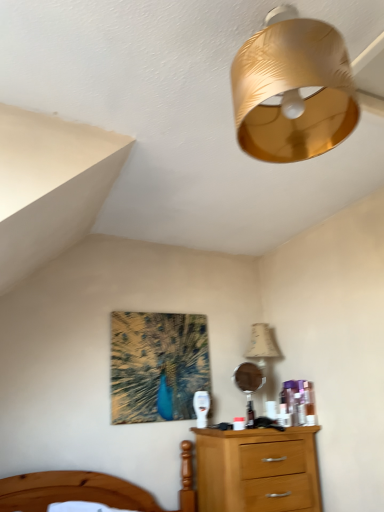
Identify the location of wooden bed at lower left. (72, 490).

What do you see at coordinates (72, 490) in the screenshot? Image resolution: width=384 pixels, height=512 pixels. I see `wooden bed at lower left` at bounding box center [72, 490].

You are a GUI agent. You are given a task and a screenshot of the screen. Output one action in this format:
    pyautogui.click(x=<x>, y=<y>)
    Task: Click on the beige fabric lampshade at upper right
    This screenshot has height=512, width=384.
    Given the screenshot: What is the action you would take?
    (x=263, y=353)

Locate an element on the screen. The height and width of the screenshot is (512, 384). wooden bed at lower left is located at coordinates pos(72,490).

From the picture: From the image's perspective, is beige fabric lampshade at upper right under metallic round mirror at center?

No.

You are a GUI agent. You are given a task and a screenshot of the screen. Output one action in this format:
    pyautogui.click(x=<x>, y=<y>)
    Task: Click on the mirror in front of the beige fabric lampshade at upper right
    The width and height of the screenshot is (384, 512).
    Given the screenshot: What is the action you would take?
    pyautogui.click(x=249, y=386)

Is beige fabric lampshade at upper right oriented away from metallic round mirror at center?

No, beige fabric lampshade at upper right is not facing the opposite direction of metallic round mirror at center.

How many degrees apart are the facing directions of beige fabric lampshade at upper right and gold textured lampshade at upper center?

The angular difference between beige fabric lampshade at upper right and gold textured lampshade at upper center is 5.53 degrees.

Is beige fabric lampshade at upper right positioned with its back to gold textured lampshade at upper center?

No, beige fabric lampshade at upper right is not facing the opposite direction of gold textured lampshade at upper center.

How far apart are beige fabric lampshade at upper right and gold textured lampshade at upper center?

Answer: beige fabric lampshade at upper right and gold textured lampshade at upper center are 1.80 meters apart.

From a real-world perspective, which is physically above, beige fabric lampshade at upper right or gold textured lampshade at upper center?

In real-world perspective, gold textured lampshade at upper center is above.

Is gold textured lampshade at upper center facing away from wooden bed at lower left?

No, gold textured lampshade at upper center is not facing the opposite direction of wooden bed at lower left.

Is gold textured lampshade at upper center inside the boundaries of wooden bed at lower left, or outside?

gold textured lampshade at upper center is not enclosed by wooden bed at lower left.

Between gold textured lampshade at upper center and wooden bed at lower left, which one appears on the left side from the viewer's perspective?

wooden bed at lower left.

From a real-world perspective, is metallic round mirror at center positioned under beige fabric lampshade at upper right based on gravity?

Indeed, from a real-world perspective, metallic round mirror at center is positioned beneath beige fabric lampshade at upper right.

How different are the orientations of metallic round mirror at center and beige fabric lampshade at upper right in degrees?

They differ by 4.13 degrees in their facing directions.

Is metallic round mirror at center to the right of beige fabric lampshade at upper right from the viewer's perspective?

No.

Is gold textured lampshade at upper center at the back of wooden bed at lower left?

No, wooden bed at lower left is not facing away from gold textured lampshade at upper center.

Can gold textured lampshade at upper center be found inside wooden bed at lower left?

No, gold textured lampshade at upper center is not a part of wooden bed at lower left.

Can you tell me how much wooden bed at lower left and gold textured lampshade at upper center differ in facing direction?

The angular difference between wooden bed at lower left and gold textured lampshade at upper center is 16.4 degrees.

Is metallic round mirror at center to the right of wooden bed at lower left from the viewer's perspective?

Yes.

From a real-world perspective, which is physically above, metallic round mirror at center or wooden bed at lower left?

metallic round mirror at center, from a real-world perspective.

Considering the points (245, 362) and (18, 478), which point is in front, point (245, 362) or point (18, 478)?

The point (18, 478) is in front.

Is metallic round mirror at center in front of or behind wooden bed at lower left in the image?

metallic round mirror at center is behind wooden bed at lower left.

Considering the relative positions of gold textured lampshade at upper center and metallic round mirror at center in the image provided, is gold textured lampshade at upper center behind metallic round mirror at center?

No, it is not.

Identify the location of mirror below the gold textured lampshade at upper center (from a real-world perspective). The height and width of the screenshot is (512, 384). (249, 386).

From the image's perspective, which one is positioned lower, gold textured lampshade at upper center or metallic round mirror at center?

From the image's view, metallic round mirror at center is below.

Does gold textured lampshade at upper center touch metallic round mirror at center?

No, gold textured lampshade at upper center is not with metallic round mirror at center.

The image size is (384, 512). I want to click on table lamp on the right side of metallic round mirror at center, so click(x=263, y=353).

Find the location of a particular element. The height and width of the screenshot is (512, 384). lamp above the beige fabric lampshade at upper right (from a real-world perspective) is located at coordinates (292, 89).

Consider the image. Based on their spatial positions, is beige fabric lampshade at upper right or wooden bed at lower left closer to gold textured lampshade at upper center?

beige fabric lampshade at upper right lies closer to gold textured lampshade at upper center than the other object.

Looking at the image, which one is located further to beige fabric lampshade at upper right, gold textured lampshade at upper center or wooden bed at lower left?

Based on the image, gold textured lampshade at upper center appears to be further to beige fabric lampshade at upper right.

Which object lies further to the anchor point beige fabric lampshade at upper right, metallic round mirror at center or wooden bed at lower left?

Based on the image, wooden bed at lower left appears to be further to beige fabric lampshade at upper right.

From the image, which object appears to be farther from gold textured lampshade at upper center, wooden bed at lower left or beige fabric lampshade at upper right?

wooden bed at lower left is further to gold textured lampshade at upper center.

From the image, which object appears to be nearer to wooden bed at lower left, gold textured lampshade at upper center or beige fabric lampshade at upper right?

beige fabric lampshade at upper right.

When comparing their distances from metallic round mirror at center, does wooden bed at lower left or beige fabric lampshade at upper right seem closer?

beige fabric lampshade at upper right is closer to metallic round mirror at center.

From the image, which object appears to be farther from beige fabric lampshade at upper right, wooden bed at lower left or metallic round mirror at center?

wooden bed at lower left is positioned further to the anchor beige fabric lampshade at upper right.

Based on their spatial positions, is metallic round mirror at center or beige fabric lampshade at upper right closer to gold textured lampshade at upper center?

The object closer to gold textured lampshade at upper center is metallic round mirror at center.

The width and height of the screenshot is (384, 512). Find the location of `mirror positioned between gold textured lampshade at upper center and beige fabric lampshade at upper right from near to far`. mirror positioned between gold textured lampshade at upper center and beige fabric lampshade at upper right from near to far is located at coordinates (249, 386).

At what (x,y) coordinates should I click in order to perform the action: click on mirror between gold textured lampshade at upper center and wooden bed at lower left in the vertical direction. Please return your answer as a coordinate pair (x, y). Looking at the image, I should click on (249, 386).

You are a GUI agent. You are given a task and a screenshot of the screen. Output one action in this format:
    pyautogui.click(x=<x>, y=<y>)
    Task: Click on the mirror between wooden bed at lower left and beige fabric lampshade at upper right along the z-axis
    Image resolution: width=384 pixels, height=512 pixels.
    Given the screenshot: What is the action you would take?
    pyautogui.click(x=249, y=386)

I want to click on table lamp between gold textured lampshade at upper center and wooden bed at lower left from top to bottom, so click(x=263, y=353).